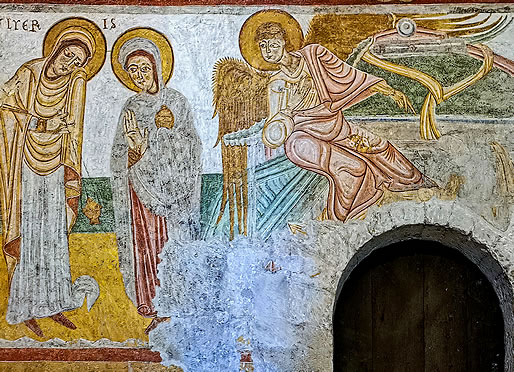
Locate an element on the screen. white color paint on wall is located at coordinates pyautogui.click(x=91, y=122).